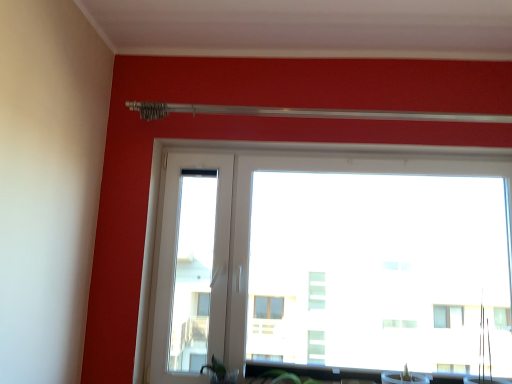
Question: From the image's perspective, is transparent glass window at center over green matte plant at lower center?

Choices:
 (A) yes
 (B) no

Answer: (A)

Question: Is transparent glass window at center at the left side of green matte plant at lower center?

Choices:
 (A) no
 (B) yes

Answer: (A)

Question: Is green matte plant at lower center at the back of transparent glass window at center?

Choices:
 (A) no
 (B) yes

Answer: (B)

Question: Does transparent glass window at center have a greater height compared to green matte plant at lower center?

Choices:
 (A) yes
 (B) no

Answer: (A)

Question: Considering the relative sizes of transparent glass window at center and green matte plant at lower center in the image provided, is transparent glass window at center smaller than green matte plant at lower center?

Choices:
 (A) no
 (B) yes

Answer: (A)

Question: Is transparent glass window at center further to the viewer compared to green matte plant at lower center?

Choices:
 (A) yes
 (B) no

Answer: (A)

Question: Is green matte plant at lower center at the right side of transparent glass window at center?

Choices:
 (A) yes
 (B) no

Answer: (B)

Question: From the image's perspective, is green matte plant at lower center over transparent glass window at center?

Choices:
 (A) yes
 (B) no

Answer: (B)

Question: Is green matte plant at lower center positioned behind transparent glass window at center?

Choices:
 (A) no
 (B) yes

Answer: (A)

Question: From a real-world perspective, is green matte plant at lower center located beneath transparent glass window at center?

Choices:
 (A) no
 (B) yes

Answer: (B)

Question: Is green matte plant at lower center outside of transparent glass window at center?

Choices:
 (A) no
 (B) yes

Answer: (B)

Question: Considering the relative positions of green matte plant at lower center and transparent glass window at center in the image provided, is green matte plant at lower center in front of transparent glass window at center?

Choices:
 (A) no
 (B) yes

Answer: (B)

Question: From the image's perspective, is transparent glass window at center above or below green matte plant at lower center?

Choices:
 (A) below
 (B) above

Answer: (B)